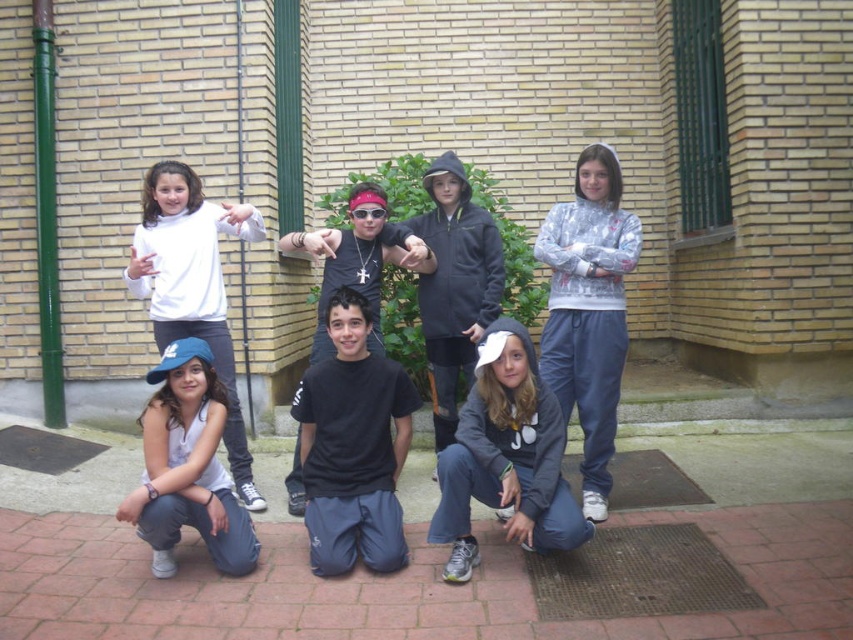
Question: Which point is farther to the camera?

Choices:
 (A) white fabric tank top at lower left
 (B) black matte t-shirt at center
 (C) gray hoodie at center

Answer: (B)

Question: Which object is the farthest from the white fabric tank top at lower left?

Choices:
 (A) white matte sweatshirt at upper left
 (B) gray fleece hoodie at right
 (C) gray hoodie at center
 (D) dark gray hoodie at center

Answer: (B)

Question: Can you confirm if white fabric tank top at lower left is positioned below white matte sweatshirt at upper left?

Choices:
 (A) no
 (B) yes

Answer: (B)

Question: Which point is closer to the camera taking this photo?

Choices:
 (A) (444, 436)
 (B) (497, 504)
 (C) (213, 248)

Answer: (B)

Question: Considering the relative positions of white fabric tank top at lower left and white matte sweatshirt at upper left in the image provided, where is white fabric tank top at lower left located with respect to white matte sweatshirt at upper left?

Choices:
 (A) above
 (B) below

Answer: (B)

Question: Where is black matte t-shirt at center located in relation to white fabric tank top at lower left in the image?

Choices:
 (A) right
 (B) left

Answer: (A)